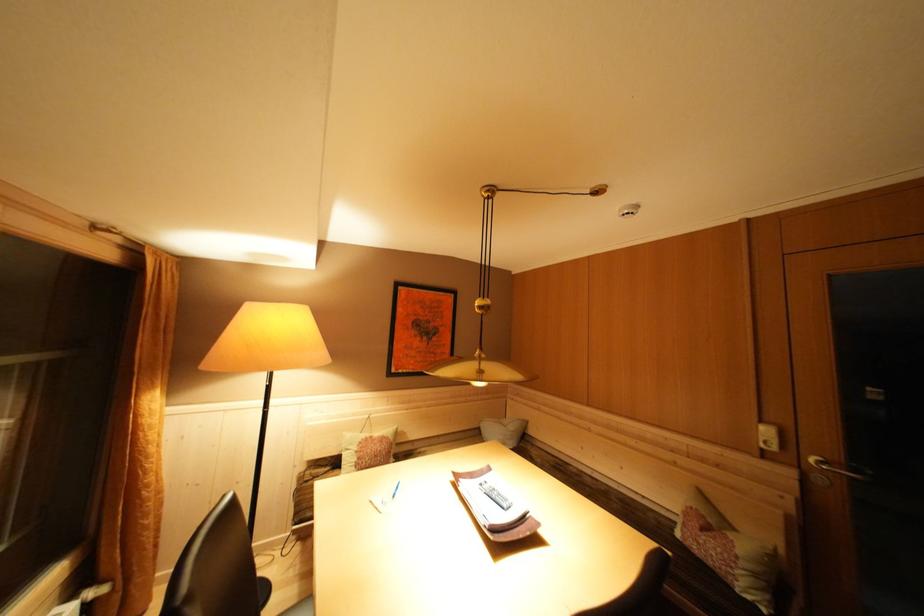
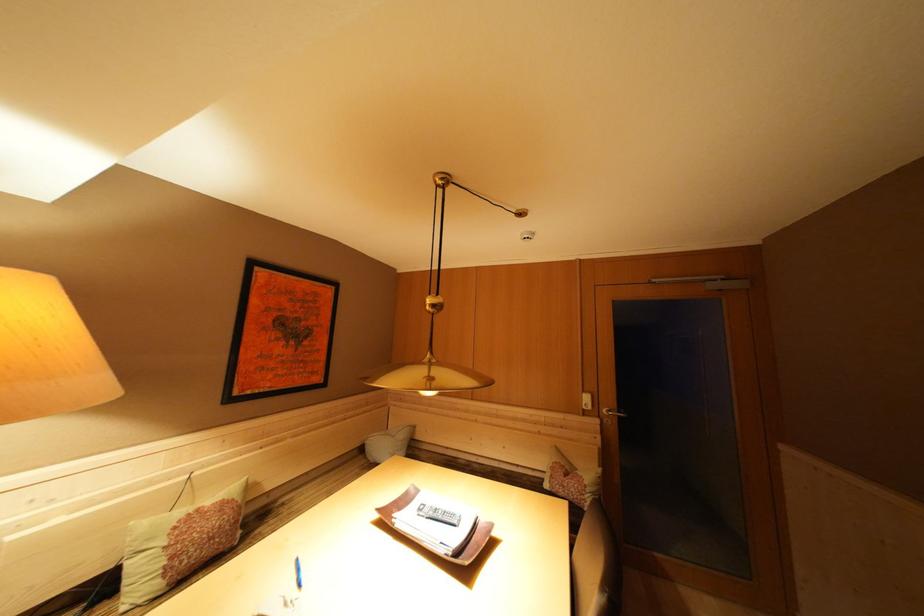
Locate, in the second image, the point that corresponds to (488,488) in the first image.

(427, 515)